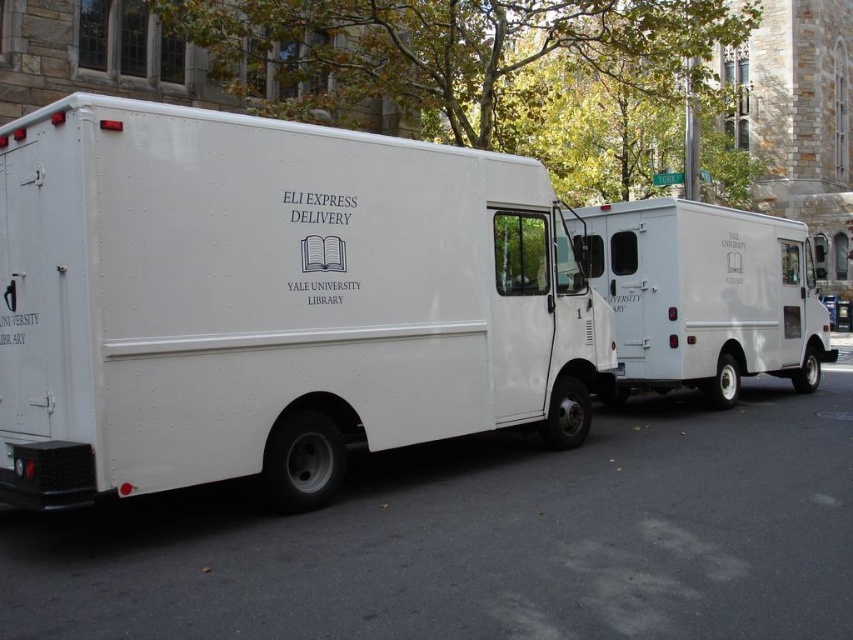
Question: Is the position of white matte van at center less distant than that of white matte van at right?

Choices:
 (A) no
 (B) yes

Answer: (B)

Question: Is white matte van at center behind white matte van at right?

Choices:
 (A) no
 (B) yes

Answer: (A)

Question: Where is white matte van at center located in relation to white matte van at right in the image?

Choices:
 (A) above
 (B) below

Answer: (B)